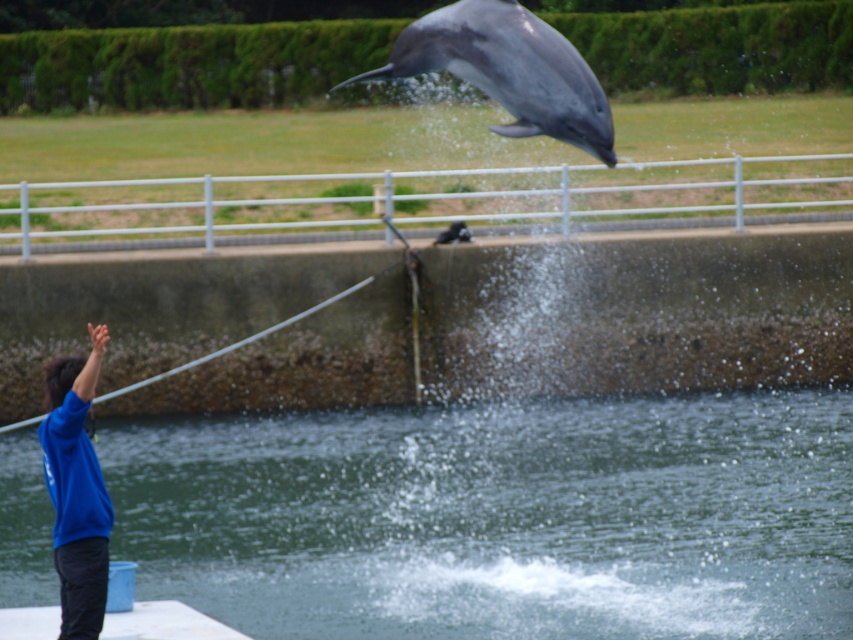
You are standing in the dolphin show area and see two points marked in the scene. Which point is closer to you, point (308, 506) or point (450, 49)?

Point (308, 506) is further to the viewer than point (450, 49), so point (450, 49) is closer to you.

You are a marine biologist observing the dolphin show. You notice the clear water at lower center and the blue fleece at left. Which object is located below the other?

The clear water at lower center is positioned under the blue fleece at left, so the clear water is below the blue fleece.